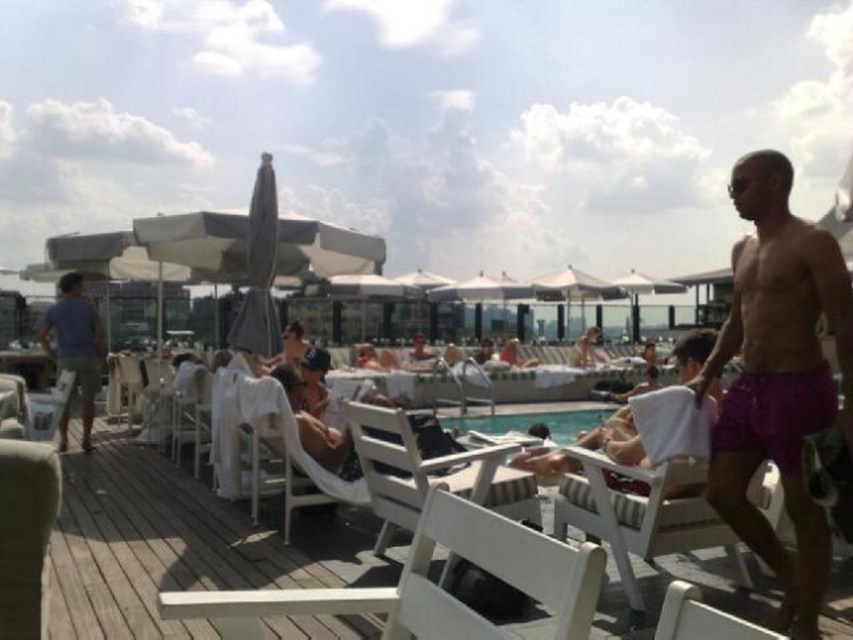
Which is more to the right, purple fabric shorts at right or white wood beach chair at center?

purple fabric shorts at right is more to the right.

Is purple fabric shorts at right to the left of white wood beach chair at center from the viewer's perspective?

No, purple fabric shorts at right is not to the left of white wood beach chair at center.

Between point (819, 532) and point (421, 484), which one is positioned behind?

The point (421, 484) is behind.

Find the location of a particular element. purple fabric shorts at right is located at coordinates (778, 380).

Does clear glass pool at center have a greater height compared to white fabric umbrella at center?

Incorrect, clear glass pool at center's height is not larger of white fabric umbrella at center's.

Is point (534, 412) less distant than point (630, 298)?

Yes, point (534, 412) is in front of point (630, 298).

Identify the location of clear glass pool at center. (534, 420).

Is white wood deck at center smaller than white fabric umbrella at center?

Yes, white wood deck at center is smaller than white fabric umbrella at center.

Is white wood deck at center to the right of white fabric umbrella at center from the viewer's perspective?

In fact, white wood deck at center is to the left of white fabric umbrella at center.

Does point (335, 522) come farther from viewer compared to point (646, 276)?

No, (335, 522) is closer to viewer.

Find the location of a particular element. The width and height of the screenshot is (853, 640). white wood deck at center is located at coordinates (183, 545).